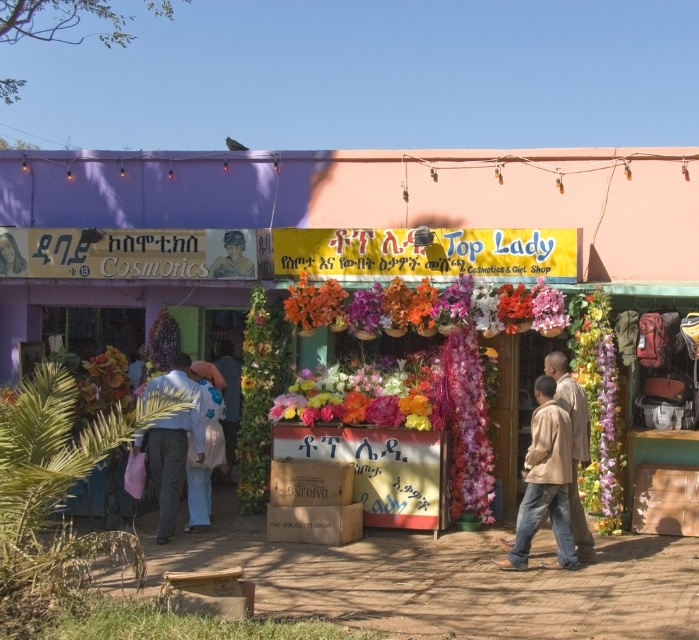
Question: Can you confirm if brown cotton jacket at lower right is bigger than floral fabric bouquet at center?

Choices:
 (A) yes
 (B) no

Answer: (A)

Question: Which of the following is the closest to the observer?

Choices:
 (A) brown cotton jacket at lower right
 (B) matte purple wall at center

Answer: (A)

Question: Which object is positioned farthest from the floral fabric bouquet at center?

Choices:
 (A) matte black signboard at center
 (B) blue fabric shirt at center
 (C) matte purple wall at center

Answer: (A)

Question: Is brown cotton jacket at lower right bigger than floral fabric bouquet at center?

Choices:
 (A) no
 (B) yes

Answer: (B)

Question: Which point is farther from the camera taking this photo?

Choices:
 (A) (152, 476)
 (B) (245, 259)
 (C) (317, 324)
 (D) (408, 408)

Answer: (B)

Question: Is matte purple wall at center further to camera compared to brown cotton jacket at lower right?

Choices:
 (A) yes
 (B) no

Answer: (A)